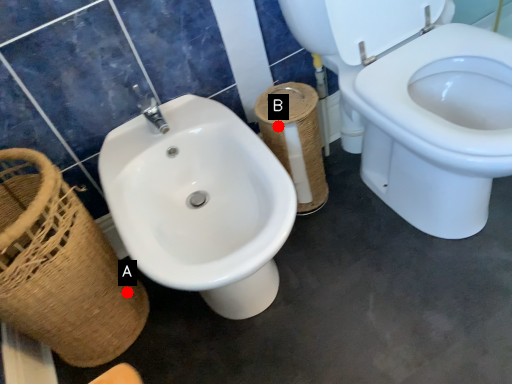
Question: Two points are circled on the image, labeled by A and B beside each circle. Which of the following is the closest to the observer?

Choices:
 (A) A is closer
 (B) B is closer

Answer: (B)